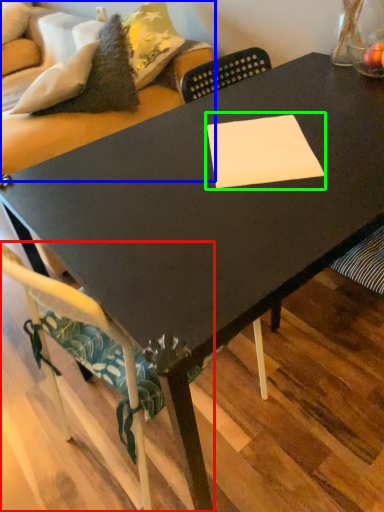
Question: Based on their relative distances, which object is nearer to chair (highlighted by a red box)? Choose from couch (highlighted by a blue box) and rectangle (highlighted by a green box).

Choices:
 (A) couch
 (B) rectangle

Answer: (B)